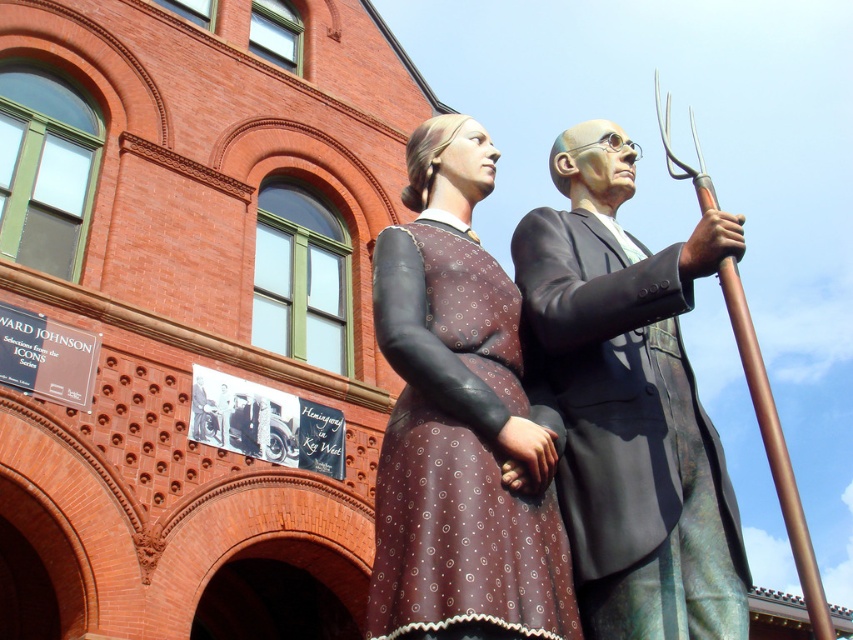
Question: Among these objects, which one is farthest from the camera?

Choices:
 (A) matte brown dress at center
 (B) shiny bronze suit at center

Answer: (B)

Question: Is shiny bronze suit at center thinner than matte brown dress at center?

Choices:
 (A) no
 (B) yes

Answer: (B)

Question: Among these objects, which one is nearest to the camera?

Choices:
 (A) matte brown dress at center
 (B) shiny bronze suit at center

Answer: (A)

Question: Can you confirm if shiny bronze suit at center is bigger than matte brown dress at center?

Choices:
 (A) yes
 (B) no

Answer: (B)

Question: Does shiny bronze suit at center lie in front of matte brown dress at center?

Choices:
 (A) no
 (B) yes

Answer: (A)